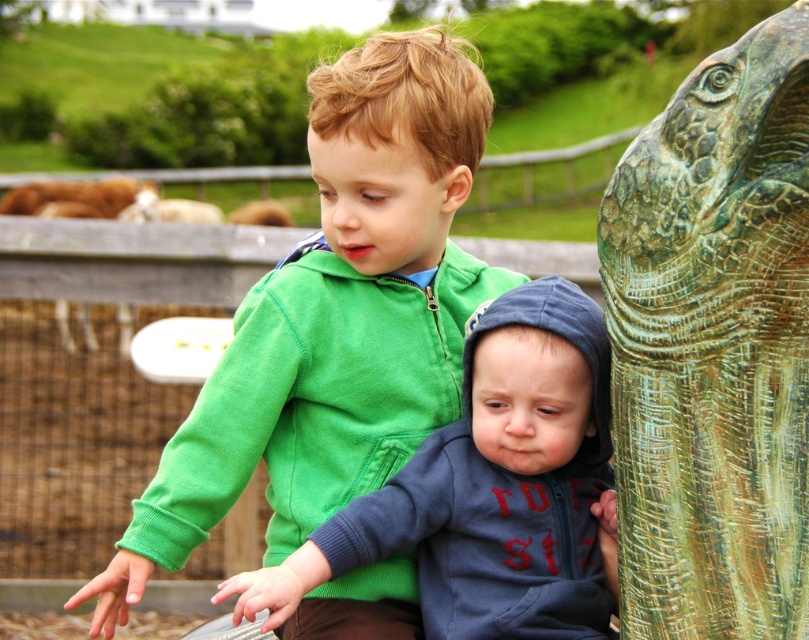
Is green patina stone elephant at right smaller than blue fleece hoodie at center?

Indeed, green patina stone elephant at right has a smaller size compared to blue fleece hoodie at center.

Is green patina stone elephant at right to the left of blue fleece hoodie at center from the viewer's perspective?

Incorrect, green patina stone elephant at right is not on the left side of blue fleece hoodie at center.

Which is in front, point (710, 531) or point (547, 627)?

Point (710, 531) is in front.

This screenshot has width=809, height=640. I want to click on green patina stone elephant at right, so click(x=714, y=346).

Does green matte hoodie at center appear on the left side of green patina stone elephant at right?

Yes, green matte hoodie at center is to the left of green patina stone elephant at right.

Identify the location of green matte hoodie at center. The height and width of the screenshot is (640, 809). (335, 317).

Locate an element on the screen. green matte hoodie at center is located at coordinates (335, 317).

Which is more to the left, green matte hoodie at center or blue fleece hoodie at center?

Positioned to the left is green matte hoodie at center.

Which is behind, point (265, 445) or point (547, 486)?

Positioned behind is point (265, 445).

Find the location of `green matte hoodie at center`. green matte hoodie at center is located at coordinates [335, 317].

Locate an element on the screen. The height and width of the screenshot is (640, 809). green matte hoodie at center is located at coordinates (335, 317).